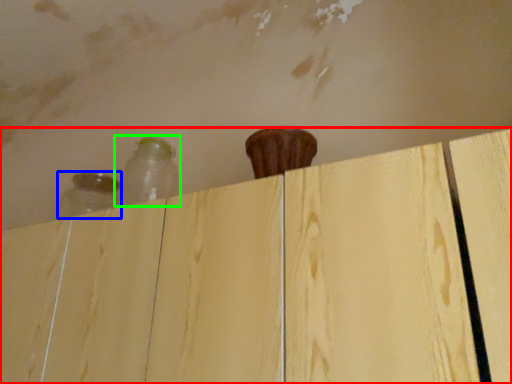
Question: Which object is the closest to the dresser (highlighted by a red box)? Choose among these: bottle (highlighted by a blue box) or bottle (highlighted by a green box).

Choices:
 (A) bottle
 (B) bottle

Answer: (B)